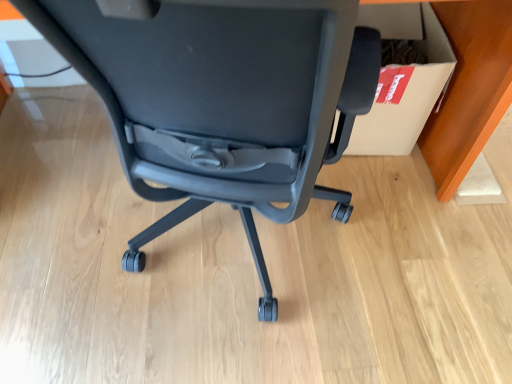
At what (x,y) coordinates should I click in order to perform the action: click on vacant region to the right of matte black chair at center. Please return your answer as a coordinate pair (x, y). This screenshot has height=384, width=512. Looking at the image, I should click on (426, 271).